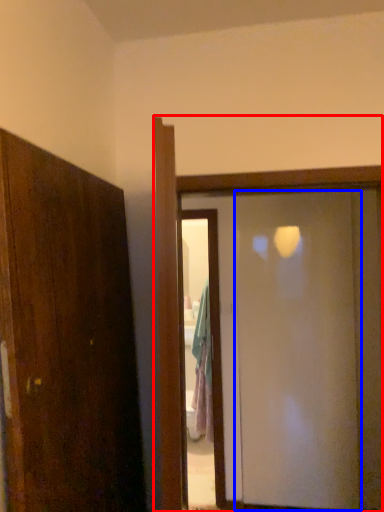
Question: Which of the following is the closest to the observer, door (highlighted by a red box) or screen door (highlighted by a blue box)?

Choices:
 (A) door
 (B) screen door

Answer: (A)